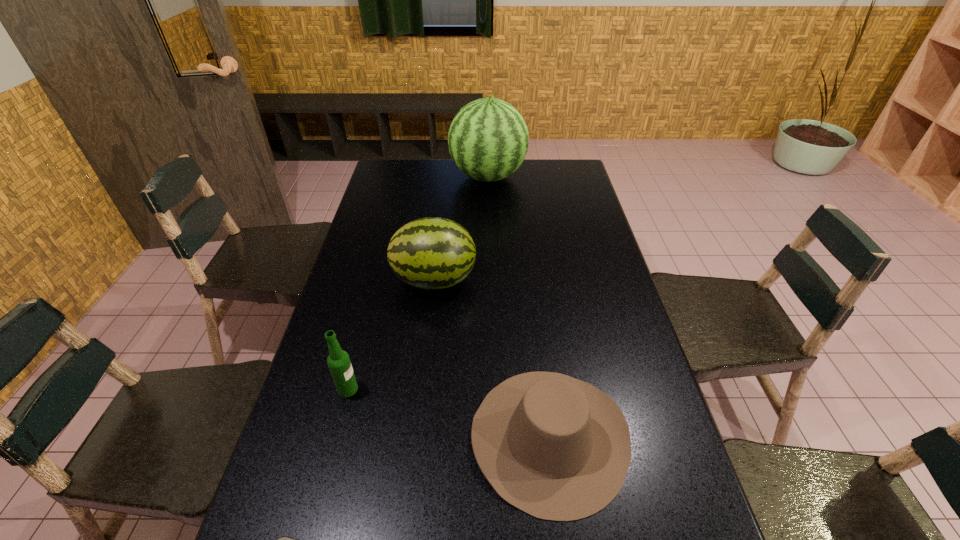
The image size is (960, 540). Find the location of `the farther watermelon`. the farther watermelon is located at coordinates (488, 139).

The width and height of the screenshot is (960, 540). I want to click on the taller watermelon, so click(488, 139).

The image size is (960, 540). What are the coordinates of `the nearer watermelon` in the screenshot? It's located at (432, 253).

Identify the location of the fourth nearest object. The width and height of the screenshot is (960, 540). (432, 253).

Identify the location of beer bottle. (338, 361).

Find the location of a particular element. cowboy hat is located at coordinates (557, 448).

Where is `vacant area situated 0.240m on the left of the farthest object`? vacant area situated 0.240m on the left of the farthest object is located at coordinates (394, 177).

Find the location of a particular element. This screenshot has width=960, height=540. free space located at the stem end of the nearer watermelon is located at coordinates coord(505,280).

You are a GUI agent. You are given a task and a screenshot of the screen. Output one action in this format:
    pyautogui.click(x=<x>, y=<y>)
    Task: Click on the vacant space located on the label of the beer bottle
    This screenshot has height=540, width=960.
    Given the screenshot: What is the action you would take?
    pyautogui.click(x=446, y=389)

Locate an element on the screen. This screenshot has height=540, width=960. vacant space located 0.060m on the left of the fourth tallest object is located at coordinates (444, 437).